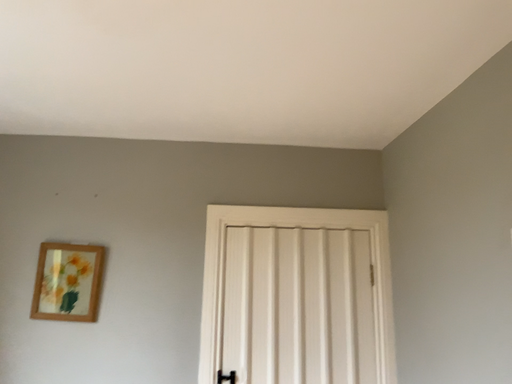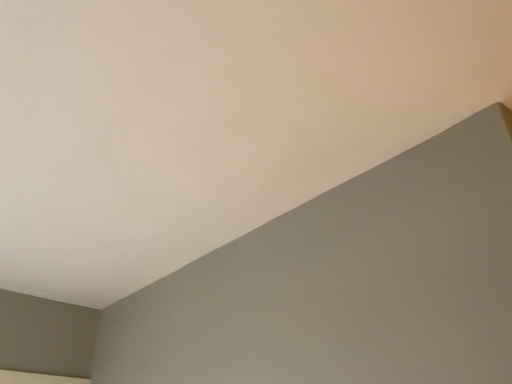
Question: How did the camera likely rotate when shooting the video?

Choices:
 (A) rotated left
 (B) rotated right

Answer: (B)